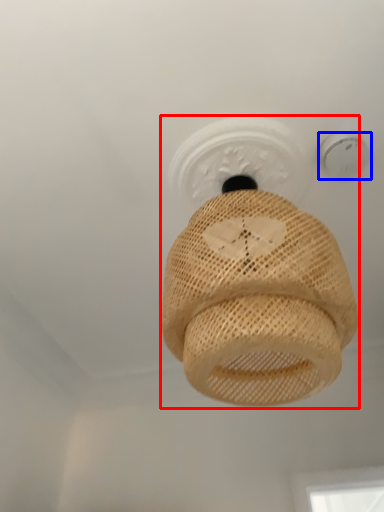
Question: Which point is further to the camera, lamp (highlighted by a red box) or light fixture (highlighted by a blue box)?

Choices:
 (A) lamp
 (B) light fixture

Answer: (B)